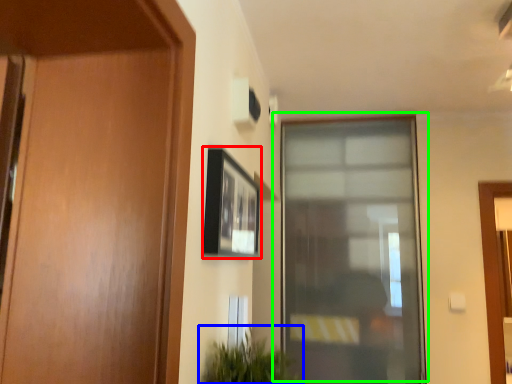
Question: Which object is the farthest from picture frame (highlighted by a red box)? Choose among these: houseplant (highlighted by a blue box) or window (highlighted by a green box).

Choices:
 (A) houseplant
 (B) window

Answer: (B)